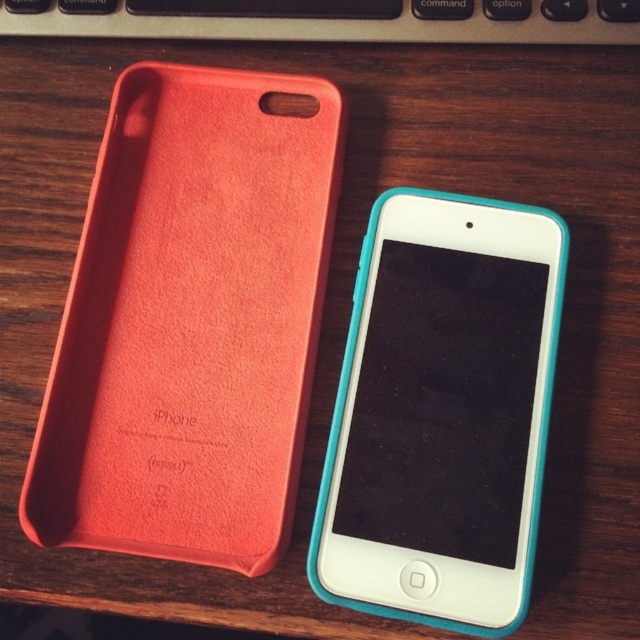
Does teal rubberized smartphone at center lie in front of black plastic keyboard at upper center?

Yes, teal rubberized smartphone at center is in front of black plastic keyboard at upper center.

Does teal rubberized smartphone at center have a greater width compared to black plastic keyboard at upper center?

No.

Does point (451, 609) come in front of point (154, 20)?

Yes, it is in front of point (154, 20).

The image size is (640, 640). I want to click on teal rubberized smartphone at center, so click(442, 413).